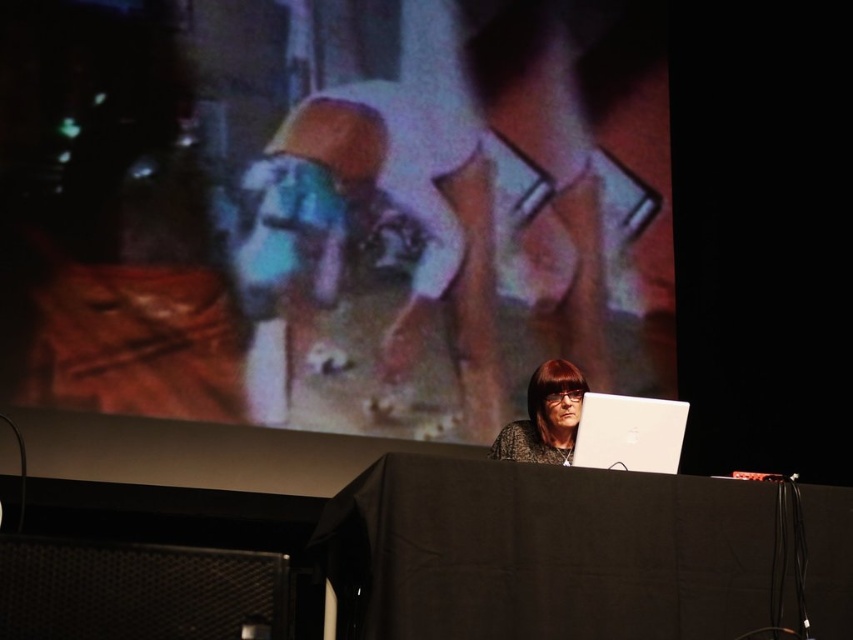
Question: Does silver metallic laptop at center have a greater width compared to matte black hair at center?

Choices:
 (A) yes
 (B) no

Answer: (A)

Question: Observing the image, what is the correct spatial positioning of black matte table at center in reference to black mesh speaker at lower left?

Choices:
 (A) right
 (B) left

Answer: (A)

Question: Among these objects, which one is farthest from the camera?

Choices:
 (A) black matte table at center
 (B) black mesh speaker at lower left

Answer: (A)

Question: Can you confirm if black matte table at center is positioned below black mesh speaker at lower left?

Choices:
 (A) no
 (B) yes

Answer: (B)

Question: Which point appears farthest from the camera in this image?

Choices:
 (A) (566, 381)
 (B) (596, 429)
 (C) (502, 540)
 (D) (3, 586)

Answer: (A)

Question: Which object is farther from the camera taking this photo?

Choices:
 (A) black mesh speaker at lower left
 (B) silver metallic laptop at center
 (C) black matte table at center
 (D) matte black hair at center

Answer: (D)